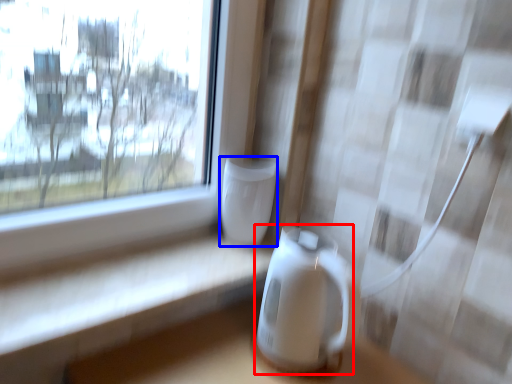
Question: Among these objects, which one is nearest to the camera, appliance (highlighted by a red box) or appliance (highlighted by a blue box)?

Choices:
 (A) appliance
 (B) appliance

Answer: (A)